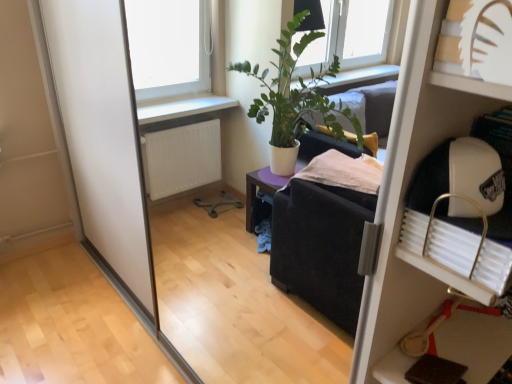
This screenshot has width=512, height=384. In order to click on white plastic shelf at upper right, acting as the first shelf starting from the right in this screenshot , I will do `click(405, 197)`.

This screenshot has width=512, height=384. What do you see at coordinates (405, 197) in the screenshot? I see `white plastic shelf at upper right, which ranks as the 1th shelf in back-to-front order` at bounding box center [405, 197].

At what (x,y) coordinates should I click in order to perform the action: click on white paper cutout at upper right, the 2th shelf positioned from the bottom. Please return your answer as a coordinate pair (x, y). The width and height of the screenshot is (512, 384). Looking at the image, I should click on (476, 48).

This screenshot has width=512, height=384. Describe the element at coordinates (476, 48) in the screenshot. I see `white paper cutout at upper right, which is the 1th shelf in left-to-right order` at that location.

Identify the location of white plastic shelf at upper right, acting as the first shelf starting from the right. This screenshot has height=384, width=512. (405, 197).

Which is more to the left, white plastic shelf at upper right, the second shelf in the left-to-right sequence, or white paper cutout at upper right, the 1th shelf viewed from the front?

Positioned to the left is white paper cutout at upper right, the 1th shelf viewed from the front.

Is white plastic shelf at upper right, acting as the first shelf starting from the right, in front of white paper cutout at upper right, the 2th shelf positioned from the bottom?

No, white plastic shelf at upper right, acting as the first shelf starting from the right, is behind white paper cutout at upper right, the 2th shelf positioned from the bottom.

Which is closer to the camera, (362,346) or (454,19)?

Point (362,346).

From the image's perspective, which is above, white plastic shelf at upper right, acting as the first shelf starting from the right, or white paper cutout at upper right, the 2th shelf positioned from the bottom?

white paper cutout at upper right, the 2th shelf positioned from the bottom, from the image's perspective.

In the scene shown: From a real-world perspective, who is located higher, white plastic shelf at upper right, the first shelf from the bottom, or white paper cutout at upper right, which is the 1th shelf from top to bottom?

white paper cutout at upper right, which is the 1th shelf from top to bottom, from a real-world perspective.

Is white plastic shelf at upper right, acting as the 2th shelf starting from the front, wider or thinner than white paper cutout at upper right, the 1th shelf viewed from the front?

Considering their sizes, white plastic shelf at upper right, acting as the 2th shelf starting from the front, looks broader than white paper cutout at upper right, the 1th shelf viewed from the front.

Is white plastic shelf at upper right, the first shelf from the bottom, shorter than white paper cutout at upper right, the 1th shelf viewed from the front?

No, white plastic shelf at upper right, the first shelf from the bottom, is not shorter than white paper cutout at upper right, the 1th shelf viewed from the front.

Between white plastic shelf at upper right, which ranks as the 1th shelf in back-to-front order, and white paper cutout at upper right, the 2th shelf in the back-to-front sequence, which one has larger size?

Bigger between the two is white plastic shelf at upper right, which ranks as the 1th shelf in back-to-front order.

Is white plastic shelf at upper right, placed as the second shelf when sorted from top to bottom, outside of white paper cutout at upper right, the 2th shelf when ordered from right to left?

Yes, white plastic shelf at upper right, placed as the second shelf when sorted from top to bottom, is located beyond the bounds of white paper cutout at upper right, the 2th shelf when ordered from right to left.

Are white plastic shelf at upper right, acting as the first shelf starting from the right, and white paper cutout at upper right, the 2th shelf when ordered from right to left, located far from each other?

No, white plastic shelf at upper right, acting as the first shelf starting from the right, is not far away from white paper cutout at upper right, the 2th shelf when ordered from right to left.

In the scene shown: Is white plastic shelf at upper right, placed as the second shelf when sorted from top to bottom, oriented away from white paper cutout at upper right, the 2th shelf positioned from the bottom?

white plastic shelf at upper right, placed as the second shelf when sorted from top to bottom, is not turned away from white paper cutout at upper right, the 2th shelf positioned from the bottom.

How distant is white plastic shelf at upper right, the second shelf in the left-to-right sequence, from white paper cutout at upper right, the 2th shelf in the back-to-front sequence?

white plastic shelf at upper right, the second shelf in the left-to-right sequence, and white paper cutout at upper right, the 2th shelf in the back-to-front sequence, are 11.41 inches apart.

Where is `shelf that appears above the white plastic shelf at upper right, the second shelf in the left-to-right sequence (from the image's perspective)`? Image resolution: width=512 pixels, height=384 pixels. shelf that appears above the white plastic shelf at upper right, the second shelf in the left-to-right sequence (from the image's perspective) is located at coordinates (476, 48).

Considering the positions of objects white paper cutout at upper right, the 2th shelf positioned from the bottom, and white plastic shelf at upper right, which ranks as the 1th shelf in back-to-front order, in the image provided, who is more to the right, white paper cutout at upper right, the 2th shelf positioned from the bottom, or white plastic shelf at upper right, which ranks as the 1th shelf in back-to-front order,?

white plastic shelf at upper right, which ranks as the 1th shelf in back-to-front order.

Does white paper cutout at upper right, the 2th shelf when ordered from right to left, come behind white plastic shelf at upper right, placed as the second shelf when sorted from top to bottom?

No.

Which is nearer, (x=501, y=80) or (x=408, y=75)?

Point (x=501, y=80) is positioned closer to the camera compared to point (x=408, y=75).

From the image's perspective, relative to white plastic shelf at upper right, acting as the first shelf starting from the right, is white paper cutout at upper right, the 2th shelf in the back-to-front sequence, above or below?

Clearly, from the image's perspective, white paper cutout at upper right, the 2th shelf in the back-to-front sequence, is above white plastic shelf at upper right, acting as the first shelf starting from the right.

From a real-world perspective, is white paper cutout at upper right, the 2th shelf when ordered from right to left, positioned under white plastic shelf at upper right, the first shelf from the bottom, based on gravity?

No, from a real-world perspective, white paper cutout at upper right, the 2th shelf when ordered from right to left, is not beneath white plastic shelf at upper right, the first shelf from the bottom.

Can you confirm if white paper cutout at upper right, which is the 1th shelf from top to bottom, is thinner than white plastic shelf at upper right, acting as the 2th shelf starting from the front?

Correct, the width of white paper cutout at upper right, which is the 1th shelf from top to bottom, is less than that of white plastic shelf at upper right, acting as the 2th shelf starting from the front.

Considering the sizes of objects white paper cutout at upper right, the 2th shelf in the back-to-front sequence, and white plastic shelf at upper right, acting as the first shelf starting from the right, in the image provided, who is shorter, white paper cutout at upper right, the 2th shelf in the back-to-front sequence, or white plastic shelf at upper right, acting as the first shelf starting from the right,?

white paper cutout at upper right, the 2th shelf in the back-to-front sequence.

In the scene shown: Considering the relative sizes of white paper cutout at upper right, the 2th shelf positioned from the bottom, and white plastic shelf at upper right, placed as the second shelf when sorted from top to bottom, in the image provided, is white paper cutout at upper right, the 2th shelf positioned from the bottom, bigger than white plastic shelf at upper right, placed as the second shelf when sorted from top to bottom,?

Actually, white paper cutout at upper right, the 2th shelf positioned from the bottom, might be smaller than white plastic shelf at upper right, placed as the second shelf when sorted from top to bottom.

Would you say white paper cutout at upper right, which is the 1th shelf from top to bottom, is outside white plastic shelf at upper right, acting as the first shelf starting from the right?

No, white paper cutout at upper right, which is the 1th shelf from top to bottom, is not outside of white plastic shelf at upper right, acting as the first shelf starting from the right.

Would you consider white paper cutout at upper right, which is the 1th shelf from top to bottom, to be distant from white plastic shelf at upper right, the first shelf from the bottom?

No, white paper cutout at upper right, which is the 1th shelf from top to bottom, is not far away from white plastic shelf at upper right, the first shelf from the bottom.

Is white paper cutout at upper right, the 2th shelf positioned from the bottom, turned away from white plastic shelf at upper right, which ranks as the 1th shelf in back-to-front order?

Absolutely, white paper cutout at upper right, the 2th shelf positioned from the bottom, is directed away from white plastic shelf at upper right, which ranks as the 1th shelf in back-to-front order.

How distant is white paper cutout at upper right, the 2th shelf positioned from the bottom, from white plastic shelf at upper right, acting as the first shelf starting from the right?

A distance of 11.41 inches exists between white paper cutout at upper right, the 2th shelf positioned from the bottom, and white plastic shelf at upper right, acting as the first shelf starting from the right.

This screenshot has width=512, height=384. Find the location of `shelf below the white paper cutout at upper right, the 2th shelf when ordered from right to left (from a real-world perspective)`. shelf below the white paper cutout at upper right, the 2th shelf when ordered from right to left (from a real-world perspective) is located at coordinates (405, 197).

At what (x,y) coordinates should I click in order to perform the action: click on shelf on the left of white plastic shelf at upper right, placed as the second shelf when sorted from top to bottom. Please return your answer as a coordinate pair (x, y). This screenshot has width=512, height=384. Looking at the image, I should click on (476, 48).

Where is `shelf lying in front of the white plastic shelf at upper right, acting as the first shelf starting from the right`? The height and width of the screenshot is (384, 512). shelf lying in front of the white plastic shelf at upper right, acting as the first shelf starting from the right is located at coordinates (476, 48).